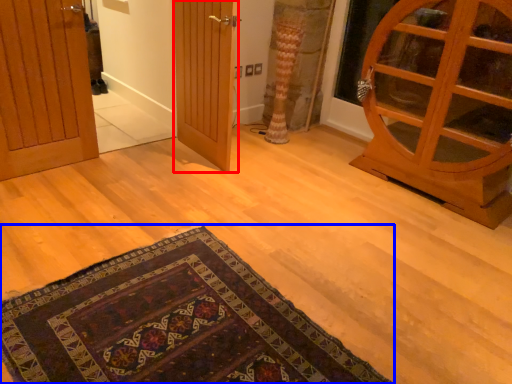
Question: Among these objects, which one is farthest to the camera, door (highlighted by a red box) or mat (highlighted by a blue box)?

Choices:
 (A) door
 (B) mat

Answer: (A)